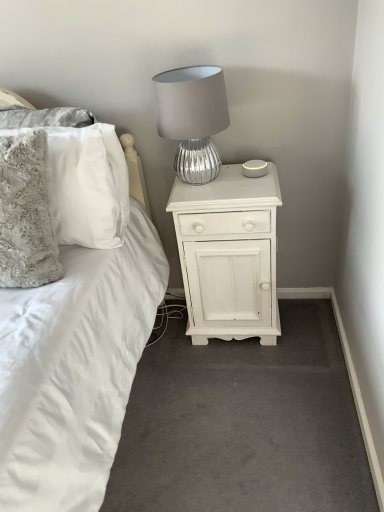
What are the coordinates of `silver textured lamp at upper center` in the screenshot? It's located at (192, 118).

The image size is (384, 512). What do you see at coordinates (26, 213) in the screenshot? I see `fluffy gray pillow at left, marked as the 1th pillow in a front-to-back arrangement` at bounding box center [26, 213].

I want to click on fluffy white pillow at left, which is the second pillow from front to back, so [x=88, y=186].

The width and height of the screenshot is (384, 512). Describe the element at coordinates (88, 186) in the screenshot. I see `fluffy white pillow at left, which is the second pillow from front to back` at that location.

Measure the distance between point (205, 276) and camera.

1.72 meters.

In order to face white painted wood nightstand at center, should I rotate leftwards or rightwards?

A 5.067 degree turn to the right will do.

Where is `silver textured lamp at upper center`? The height and width of the screenshot is (512, 384). silver textured lamp at upper center is located at coordinates (192, 118).

Considering the relative sizes of white painted wood nightstand at center and silver textured lamp at upper center in the image provided, is white painted wood nightstand at center wider than silver textured lamp at upper center?

Indeed, white painted wood nightstand at center has a greater width compared to silver textured lamp at upper center.

Identify the location of lamp on the left of the white painted wood nightstand at center. This screenshot has height=512, width=384. (192, 118).

Is white painted wood nightstand at center aimed at silver textured lamp at upper center?

No, white painted wood nightstand at center is not turned towards silver textured lamp at upper center.

Are white painted wood nightstand at center and silver textured lamp at upper center making contact?

No, white painted wood nightstand at center is not beside silver textured lamp at upper center.

From a real-world perspective, is white painted wood nightstand at center physically below fluffy white pillow at left, which is the second pillow from front to back?

Yes.

Is white painted wood nightstand at center inside the boundaries of fluffy white pillow at left, the first pillow viewed from the back, or outside?

white painted wood nightstand at center is not inside fluffy white pillow at left, the first pillow viewed from the back, it's outside.

Could you tell me if white painted wood nightstand at center is facing fluffy white pillow at left, the first pillow viewed from the back?

No, white painted wood nightstand at center is not oriented towards fluffy white pillow at left, the first pillow viewed from the back.

Identify the location of the 1st pillow positioned above the white painted wood nightstand at center (from a real-world perspective). This screenshot has height=512, width=384. (88, 186).

Where is `the 2nd pillow directly above the white painted wood nightstand at center (from a real-world perspective)`? The height and width of the screenshot is (512, 384). the 2nd pillow directly above the white painted wood nightstand at center (from a real-world perspective) is located at coordinates (26, 213).

Does white painted wood nightstand at center touch fluffy gray pillow at left, the 2th pillow in the back-to-front sequence?

white painted wood nightstand at center and fluffy gray pillow at left, the 2th pillow in the back-to-front sequence, are clearly separated.

Looking at their sizes, would you say white painted wood nightstand at center is wider or thinner than fluffy gray pillow at left, marked as the 1th pillow in a front-to-back arrangement?

Considering their sizes, white painted wood nightstand at center looks broader than fluffy gray pillow at left, marked as the 1th pillow in a front-to-back arrangement.

Which is more to the left, fluffy white pillow at left, which is the second pillow from front to back, or fluffy gray pillow at left, marked as the 1th pillow in a front-to-back arrangement?

fluffy gray pillow at left, marked as the 1th pillow in a front-to-back arrangement, is more to the left.

Is fluffy gray pillow at left, marked as the 1th pillow in a front-to-back arrangement, at the back of fluffy white pillow at left, which is the second pillow from front to back?

Yes, fluffy white pillow at left, which is the second pillow from front to back, is positioned with its back facing fluffy gray pillow at left, marked as the 1th pillow in a front-to-back arrangement.

Find the location of a particular element. The width and height of the screenshot is (384, 512). pillow on the right of the fluffy gray pillow at left, the 2th pillow in the back-to-front sequence is located at coordinates (x=88, y=186).

Is fluffy white pillow at left, which is the second pillow from front to back, far away from fluffy gray pillow at left, the 2th pillow in the back-to-front sequence?

That's not correct — fluffy white pillow at left, which is the second pillow from front to back, is a little close to fluffy gray pillow at left, the 2th pillow in the back-to-front sequence.

From a real-world perspective, between silver textured lamp at upper center and fluffy white pillow at left, which is the second pillow from front to back, who is vertically higher?

silver textured lamp at upper center.

Looking at their sizes, would you say silver textured lamp at upper center is wider or thinner than fluffy white pillow at left, which is the second pillow from front to back?

Clearly, silver textured lamp at upper center has more width compared to fluffy white pillow at left, which is the second pillow from front to back.

Looking at this image, is silver textured lamp at upper center completely or partially outside of fluffy white pillow at left, which is the second pillow from front to back?

Yes, silver textured lamp at upper center is located beyond the bounds of fluffy white pillow at left, which is the second pillow from front to back.

Can you confirm if fluffy white pillow at left, the first pillow viewed from the back, is thinner than silver textured lamp at upper center?

Correct, the width of fluffy white pillow at left, the first pillow viewed from the back, is less than that of silver textured lamp at upper center.

Between fluffy white pillow at left, the first pillow viewed from the back, and silver textured lamp at upper center, which one is positioned behind?

Positioned behind is silver textured lamp at upper center.

Is point (105, 196) closer to camera compared to point (171, 131)?

Yes.

Based on the photo, is fluffy white pillow at left, which is the second pillow from front to back, positioned beyond the bounds of silver textured lamp at upper center?

fluffy white pillow at left, which is the second pillow from front to back, is positioned outside silver textured lamp at upper center.

What's the angular difference between fluffy gray pillow at left, the 2th pillow in the back-to-front sequence, and silver textured lamp at upper center's facing directions?

The facing directions of fluffy gray pillow at left, the 2th pillow in the back-to-front sequence, and silver textured lamp at upper center are 0.0657 degrees apart.

Are fluffy gray pillow at left, the 2th pillow in the back-to-front sequence, and silver textured lamp at upper center located far from each other?

No, fluffy gray pillow at left, the 2th pillow in the back-to-front sequence, is not far away from silver textured lamp at upper center.

Is fluffy gray pillow at left, the 2th pillow in the back-to-front sequence, turned away from silver textured lamp at upper center?

No, silver textured lamp at upper center is not at the back of fluffy gray pillow at left, the 2th pillow in the back-to-front sequence.

Would you say fluffy gray pillow at left, marked as the 1th pillow in a front-to-back arrangement, contains silver textured lamp at upper center?

Definitely not — silver textured lamp at upper center is not inside fluffy gray pillow at left, marked as the 1th pillow in a front-to-back arrangement.

At what (x,y) coordinates should I click in order to perform the action: click on nightstand behind the silver textured lamp at upper center. Please return your answer as a coordinate pair (x, y). Looking at the image, I should click on (229, 254).

The width and height of the screenshot is (384, 512). I want to click on pillow that is the 1st object to the left of the white painted wood nightstand at center, starting at the anchor, so click(88, 186).

Looking at the image, which one is located further to white painted wood nightstand at center, fluffy white pillow at left, which is the second pillow from front to back, or silver textured lamp at upper center?

Among the two, fluffy white pillow at left, which is the second pillow from front to back, is located further to white painted wood nightstand at center.

Which object lies further to the anchor point silver textured lamp at upper center, white painted wood nightstand at center or fluffy gray pillow at left, the 2th pillow in the back-to-front sequence?

The object further to silver textured lamp at upper center is fluffy gray pillow at left, the 2th pillow in the back-to-front sequence.

Looking at the image, which one is located further to fluffy white pillow at left, which is the second pillow from front to back, white painted wood nightstand at center or fluffy gray pillow at left, the 2th pillow in the back-to-front sequence?

Based on the image, white painted wood nightstand at center appears to be further to fluffy white pillow at left, which is the second pillow from front to back.

Estimate the real-world distances between objects in this image. Which object is further from white painted wood nightstand at center, silver textured lamp at upper center or fluffy gray pillow at left, the 2th pillow in the back-to-front sequence?

fluffy gray pillow at left, the 2th pillow in the back-to-front sequence, is further to white painted wood nightstand at center.

Which object lies nearer to the anchor point fluffy white pillow at left, which is the second pillow from front to back, silver textured lamp at upper center or white painted wood nightstand at center?

silver textured lamp at upper center lies closer to fluffy white pillow at left, which is the second pillow from front to back, than the other object.

From the image, which object appears to be farther from silver textured lamp at upper center, fluffy gray pillow at left, marked as the 1th pillow in a front-to-back arrangement, or white painted wood nightstand at center?

Among the two, fluffy gray pillow at left, marked as the 1th pillow in a front-to-back arrangement, is located further to silver textured lamp at upper center.

In the scene shown: Estimate the real-world distances between objects in this image. Which object is closer to fluffy gray pillow at left, marked as the 1th pillow in a front-to-back arrangement, white painted wood nightstand at center or silver textured lamp at upper center?

The object closer to fluffy gray pillow at left, marked as the 1th pillow in a front-to-back arrangement, is silver textured lamp at upper center.

Looking at the image, which one is located further to fluffy white pillow at left, which is the second pillow from front to back, silver textured lamp at upper center or fluffy gray pillow at left, the 2th pillow in the back-to-front sequence?

silver textured lamp at upper center is positioned further to the anchor fluffy white pillow at left, which is the second pillow from front to back.

Where is `pillow between fluffy gray pillow at left, marked as the 1th pillow in a front-to-back arrangement, and white painted wood nightstand at center, in the horizontal direction`? Image resolution: width=384 pixels, height=512 pixels. pillow between fluffy gray pillow at left, marked as the 1th pillow in a front-to-back arrangement, and white painted wood nightstand at center, in the horizontal direction is located at coordinates (88, 186).

The width and height of the screenshot is (384, 512). Find the location of `lamp located between fluffy white pillow at left, the first pillow viewed from the back, and white painted wood nightstand at center in the left-right direction`. lamp located between fluffy white pillow at left, the first pillow viewed from the back, and white painted wood nightstand at center in the left-right direction is located at coordinates (192, 118).

This screenshot has height=512, width=384. Identify the location of pillow situated between fluffy gray pillow at left, marked as the 1th pillow in a front-to-back arrangement, and silver textured lamp at upper center from left to right. (88, 186).

Find the location of a particular element. lamp between fluffy gray pillow at left, marked as the 1th pillow in a front-to-back arrangement, and white painted wood nightstand at center, in the horizontal direction is located at coordinates (192, 118).